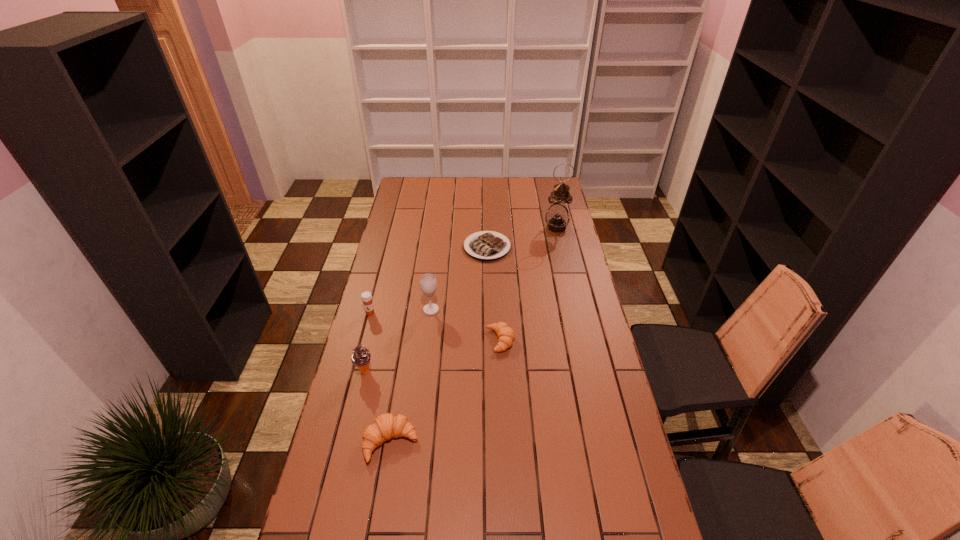
You are a GUI agent. You are given a task and a screenshot of the screen. Output one action in this format:
    pyautogui.click(x=<x>, y=<y>)
    Task: Click on the nearest object
    
    Given the screenshot: What is the action you would take?
    tap(386, 426)

In order to click on the left crescent roll in this screenshot , I will do `click(386, 426)`.

What are the coordinates of `the farther crescent roll` in the screenshot? It's located at (506, 335).

Where is `the sixth tallest object`? This screenshot has height=540, width=960. the sixth tallest object is located at coordinates click(x=506, y=335).

Identify the location of the tallest object. (557, 217).

The height and width of the screenshot is (540, 960). In order to click on oil lamp in this screenshot , I will do `click(557, 217)`.

The image size is (960, 540). I want to click on wineglass, so click(428, 284).

Image resolution: width=960 pixels, height=540 pixels. What are the coordinates of `the fourth tallest object` in the screenshot? It's located at (366, 296).

The image size is (960, 540). I want to click on the shortest object, so click(x=484, y=246).

At what (x,y) coordinates should I click in order to perform the action: click on the sixth farthest object. Please return your answer as a coordinate pair (x, y). The image size is (960, 540). Looking at the image, I should click on (361, 358).